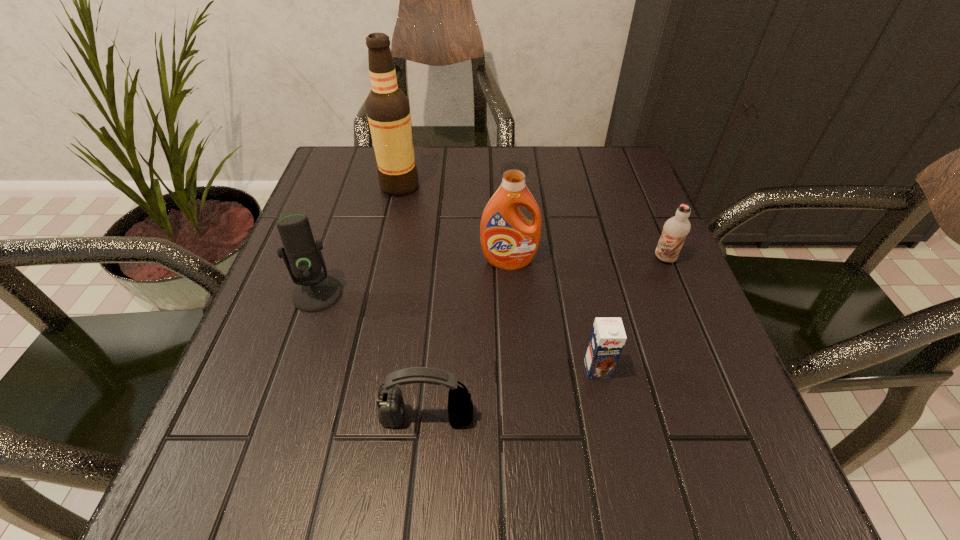
Identify the location of the left chocolate milk. (607, 339).

This screenshot has height=540, width=960. I want to click on the nearer chocolate milk, so click(607, 339).

In order to click on free spot located on the label of the farthest object in this screenshot , I will do `click(485, 186)`.

Where is `free space located 0.240m on the front-facing side of the third object from right to left`? The width and height of the screenshot is (960, 540). free space located 0.240m on the front-facing side of the third object from right to left is located at coordinates (516, 375).

Where is `vacant region located 0.100m on the front of the leftmost object`? This screenshot has height=540, width=960. vacant region located 0.100m on the front of the leftmost object is located at coordinates (295, 359).

Locate an element on the screen. The height and width of the screenshot is (540, 960). free space located on the back of the rightmost object is located at coordinates (645, 212).

Locate an element on the screen. vacant space located 0.090m on the headband of the third object from left to right is located at coordinates (420, 495).

At what (x,y) coordinates should I click in order to perform the action: click on vacant region located 0.090m on the front label of the second object from right to left. Please return your answer as a coordinate pair (x, y). Looking at the image, I should click on (611, 433).

The width and height of the screenshot is (960, 540). What are the coordinates of `object present at the far edge` in the screenshot? It's located at (387, 107).

Identify the location of alcohol that is at the left edge. The width and height of the screenshot is (960, 540). (387, 107).